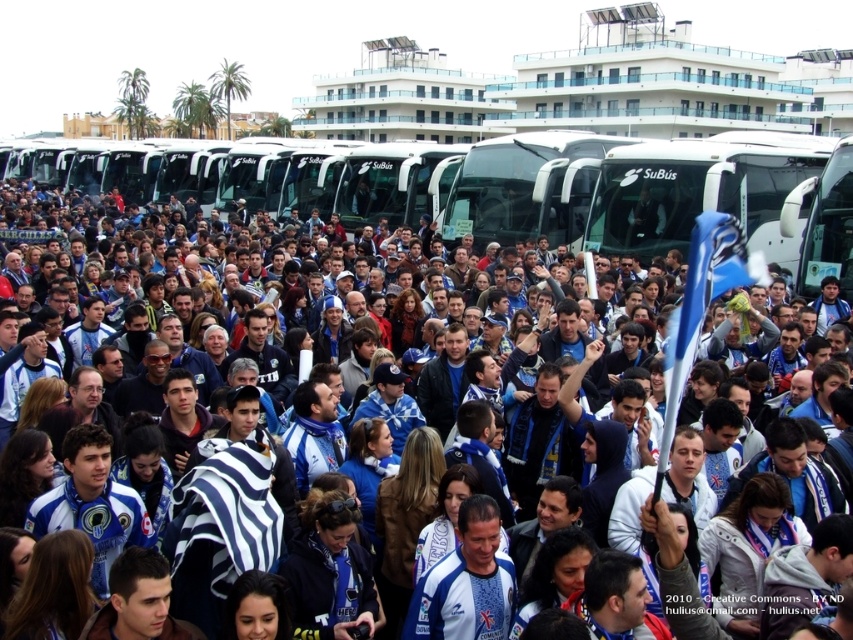
Question: In this image, where is white jersey at center located relative to white glossy tour bus at center?

Choices:
 (A) left
 (B) right

Answer: (A)

Question: Is white jersey at center to the right of white glossy tour bus at center from the viewer's perspective?

Choices:
 (A) yes
 (B) no

Answer: (B)

Question: Which of the following is the farthest from the observer?

Choices:
 (A) white glossy tour bus at center
 (B) white jersey at center

Answer: (A)

Question: Among these objects, which one is nearest to the camera?

Choices:
 (A) white glossy tour bus at center
 (B) white jersey at center

Answer: (B)

Question: Is white jersey at center positioned in front of white glossy tour bus at center?

Choices:
 (A) no
 (B) yes

Answer: (B)

Question: Which of the following is the closest to the observer?

Choices:
 (A) white jersey at center
 (B) white glossy tour bus at center

Answer: (A)